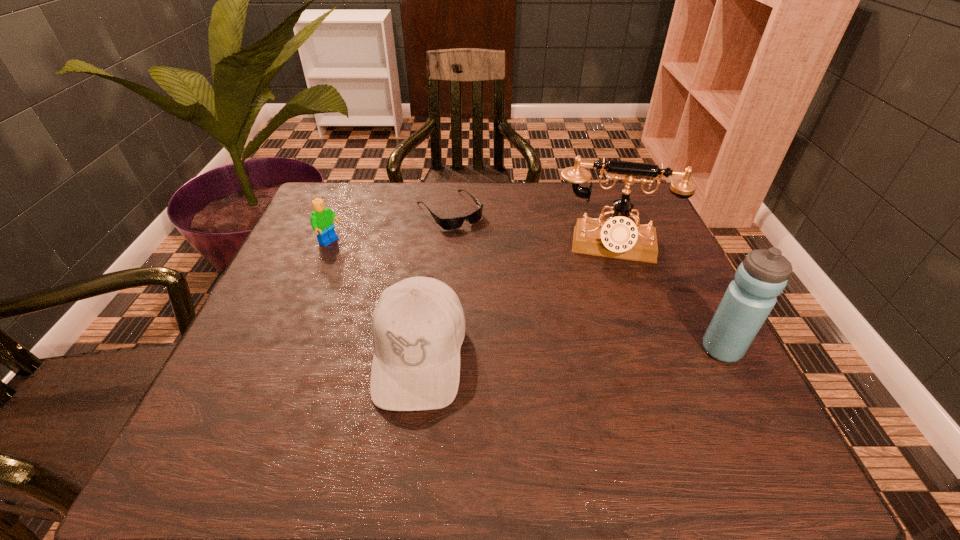
Find the location of `free spot on the desktop that is between the baseball cap and the water bottle and is positioned on the dial of the telephone`. free spot on the desktop that is between the baseball cap and the water bottle and is positioned on the dial of the telephone is located at coordinates (612, 351).

In order to click on free spot on the desktop that is between the baseball cap and the water bottle and is positioned on the face of the Lego in this screenshot , I will do `click(552, 352)`.

Find the location of a particular element. Image resolution: width=960 pixels, height=540 pixels. vacant space on the desktop that is between the baseball cap and the water bottle and is positioned on the front-facing side of the sunglasses is located at coordinates (582, 352).